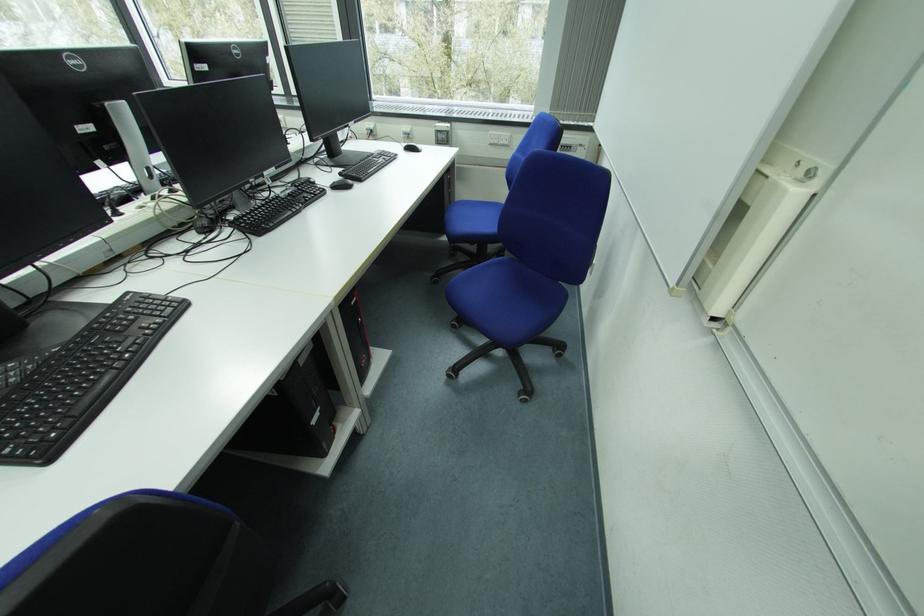
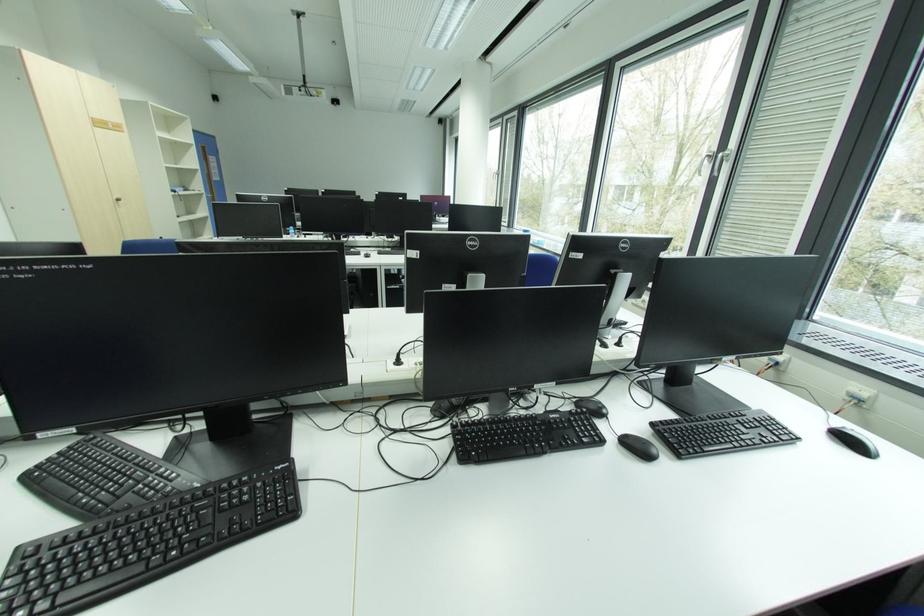
Find the pixel in the second image that matches the point at 138,294 in the first image.

(293, 466)